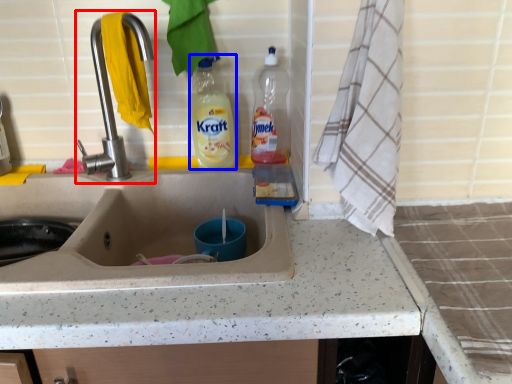
Question: Which point is closer to the camera, tap (highlighted by a red box) or bottle (highlighted by a blue box)?

Choices:
 (A) tap
 (B) bottle

Answer: (A)